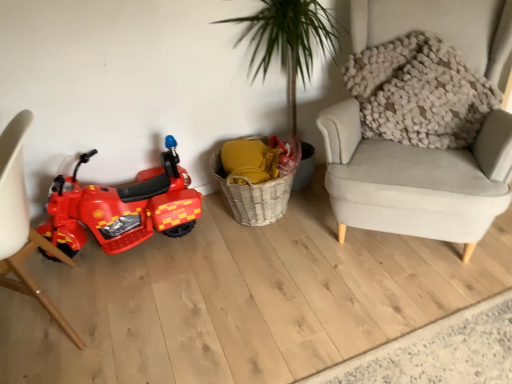
The width and height of the screenshot is (512, 384). I want to click on vacant space that's between matte white chair at left and shiny plastic toy motorcycle at left, so point(146,275).